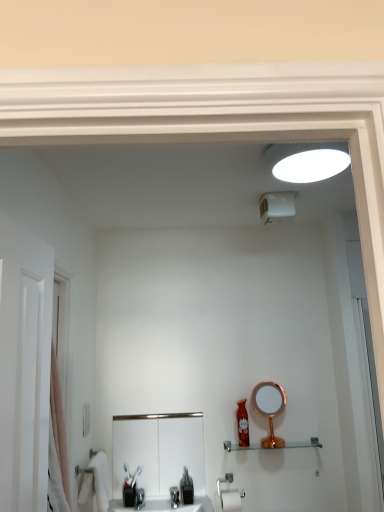
The image size is (384, 512). What do you see at coordinates (186, 488) in the screenshot? I see `black plastic soap dispenser at lower center` at bounding box center [186, 488].

What do you see at coordinates (269, 409) in the screenshot?
I see `rose gold metallic mirror at lower right` at bounding box center [269, 409].

Describe the element at coordinates (59, 423) in the screenshot. The width and height of the screenshot is (384, 512). I see `pink fabric shower curtain at left` at that location.

Measure the distance between satin nickel sink at center and camera.

satin nickel sink at center and camera are 7.38 feet apart.

The width and height of the screenshot is (384, 512). I want to click on black plastic soap dispenser at lower center, so click(x=186, y=488).

Considering the positions of point (64, 484) and point (240, 443), is point (64, 484) closer or farther from the camera than point (240, 443)?

Point (64, 484) is closer to the camera than point (240, 443).

Are pink fabric shower curtain at left and matte red bottle at center located far from each other?

Indeed, pink fabric shower curtain at left is not near matte red bottle at center.

Between pink fabric shower curtain at left and matte red bottle at center, which one appears on the right side from the viewer's perspective?

From the viewer's perspective, matte red bottle at center appears more on the right side.

Is the depth of pink fabric shower curtain at left greater than that of matte red bottle at center?

No, pink fabric shower curtain at left is closer to the camera.

Between pink fabric shower curtain at left and clear glass shelf at center, which one has smaller size?

clear glass shelf at center is smaller.

Is pink fabric shower curtain at left touching clear glass shelf at center?

pink fabric shower curtain at left and clear glass shelf at center are clearly separated.

Considering the positions of objects pink fabric shower curtain at left and clear glass shelf at center in the image provided, who is more to the left, pink fabric shower curtain at left or clear glass shelf at center?

pink fabric shower curtain at left is more to the left.

Between point (52, 384) and point (318, 447), which one is positioned behind?

The point (318, 447) is behind.

Considering the positions of objects rose gold metallic mirror at lower right and white soft towel at lower left in the image provided, who is behind, rose gold metallic mirror at lower right or white soft towel at lower left?

Positioned behind is rose gold metallic mirror at lower right.

Is rose gold metallic mirror at lower right facing away from white soft towel at lower left?

rose gold metallic mirror at lower right is not turned away from white soft towel at lower left.

Is rose gold metallic mirror at lower right to the right of white soft towel at lower left from the viewer's perspective?

Yes, rose gold metallic mirror at lower right is to the right of white soft towel at lower left.

Measure the distance from rose gold metallic mirror at lower right to white soft towel at lower left.

The distance of rose gold metallic mirror at lower right from white soft towel at lower left is 36.39 inches.

Based on their sizes in the image, would you say white soft towel at lower left is bigger or smaller than rose gold metallic mirror at lower right?

In the image, white soft towel at lower left appears to be larger than rose gold metallic mirror at lower right.

Which of these two, white soft towel at lower left or rose gold metallic mirror at lower right, is thinner?

rose gold metallic mirror at lower right.

How different are the orientations of white soft towel at lower left and rose gold metallic mirror at lower right in degrees?

90 degrees.

Do you think matte red bottle at center is within white soft towel at lower left, or outside of it?

matte red bottle at center exists outside the volume of white soft towel at lower left.

Is matte red bottle at center touching white soft towel at lower left?

matte red bottle at center and white soft towel at lower left are clearly separated.

The image size is (384, 512). Identify the location of toiletry on the right of the white soft towel at lower left. (242, 424).

Is matte red bottle at center taller or shorter than white soft towel at lower left?

Considering their sizes, matte red bottle at center has less height than white soft towel at lower left.

Who is smaller, pink fabric shower curtain at left or rose gold metallic mirror at lower right?

rose gold metallic mirror at lower right is smaller.

Is point (65, 444) closer or farther from the camera than point (270, 426)?

Clearly, point (65, 444) is closer to the camera than point (270, 426).

Is pink fabric shower curtain at left aimed at rose gold metallic mirror at lower right?

No, pink fabric shower curtain at left is not aimed at rose gold metallic mirror at lower right.

From the image's perspective, relative to pink fabric shower curtain at left, is rose gold metallic mirror at lower right above or below?

Based on their image positions, rose gold metallic mirror at lower right is located beneath pink fabric shower curtain at left.

I want to click on mirror below the pink fabric shower curtain at left (from a real-world perspective), so click(269, 409).

In the image, there is a matte red bottle at center. What are the coordinates of `shower curtain above it (from the image's perspective)` in the screenshot? It's located at (59, 423).

Locate an element on the screen. The height and width of the screenshot is (512, 384). shower curtain that appears on the left of clear glass shelf at center is located at coordinates (59, 423).

In the scene shown: Which object lies further to the anchor point rose gold metallic mirror at lower right, clear glass shelf at center or matte red bottle at center?

Among the two, clear glass shelf at center is located further to rose gold metallic mirror at lower right.

Based on their spatial positions, is black plastic soap dispenser at lower center or pink fabric shower curtain at left closer to clear glass shelf at center?

black plastic soap dispenser at lower center.

Which object lies further to the anchor point pink fabric shower curtain at left, clear glass shelf at center or matte red bottle at center?

clear glass shelf at center is further to pink fabric shower curtain at left.

When comparing their distances from satin nickel sink at center, does white soft towel at lower left or clear glass shelf at center seem further?

clear glass shelf at center is positioned further to the anchor satin nickel sink at center.

When comparing their distances from black plastic soap dispenser at lower center, does rose gold metallic mirror at lower right or clear glass shelf at center seem further?

rose gold metallic mirror at lower right is positioned further to the anchor black plastic soap dispenser at lower center.

Looking at the image, which one is located closer to clear glass shelf at center, matte red bottle at center or black plastic soap dispenser at lower center?

Among the two, matte red bottle at center is located nearer to clear glass shelf at center.

When comparing their distances from rose gold metallic mirror at lower right, does matte red bottle at center or clear glass shelf at center seem further?

The object further to rose gold metallic mirror at lower right is clear glass shelf at center.

Which object lies nearer to the anchor point rose gold metallic mirror at lower right, pink fabric shower curtain at left or matte red bottle at center?

matte red bottle at center is closer to rose gold metallic mirror at lower right.

At what (x,y) coordinates should I click in order to perform the action: click on toiletry between satin nickel sink at center and clear glass shelf at center in the horizontal direction. Please return your answer as a coordinate pair (x, y). Looking at the image, I should click on (242, 424).

Locate an element on the screen. toiletry between satin nickel sink at center and rose gold metallic mirror at lower right is located at coordinates (242, 424).

What are the coordinates of `toiletry located between black plastic soap dispenser at lower center and clear glass shelf at center in the left-right direction` in the screenshot? It's located at (242, 424).

Identify the location of mirror between matte red bottle at center and clear glass shelf at center. This screenshot has width=384, height=512. (269, 409).